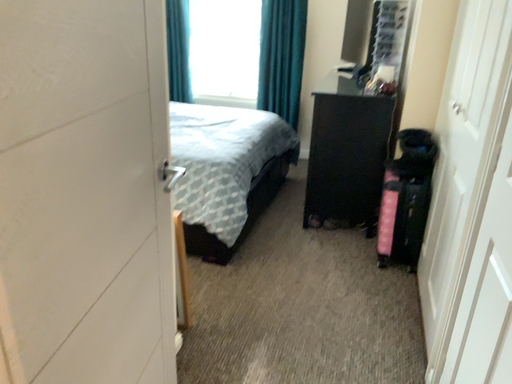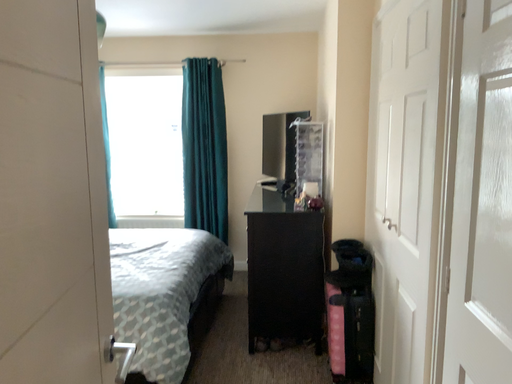
Question: How did the camera likely rotate when shooting the video?

Choices:
 (A) rotated downward
 (B) rotated upward

Answer: (B)